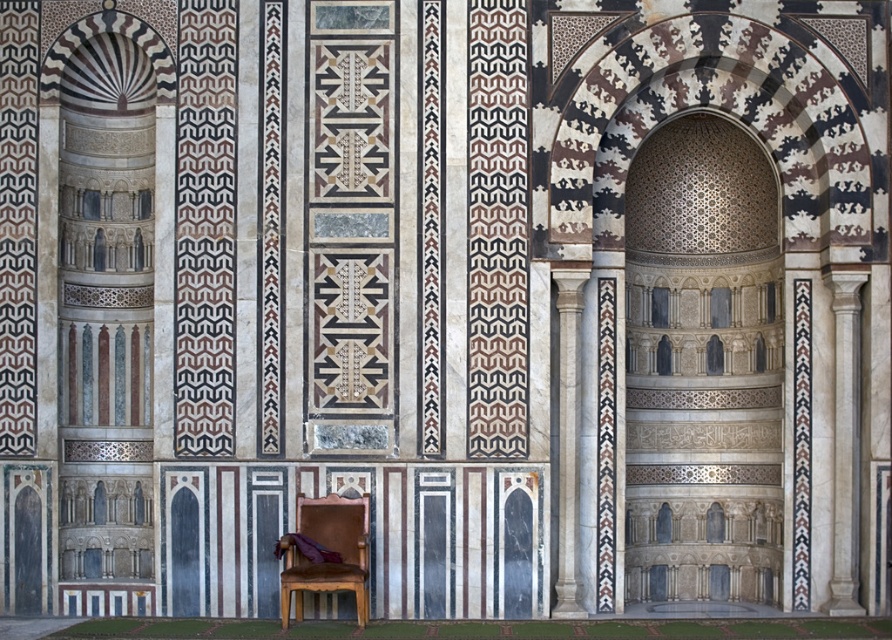
You are an interior designer planning to place a new sofa in this space. The sofa you have in mind is the same size as the white marble column at center. Would the brown leather armchair at lower center be a better fit for the space in terms of size compatibility?

The brown leather armchair at lower center is larger than the white marble column at center. Since the sofa is the same size as the column, the armchair would not be as compatible in terms of size and might overwhelm the space.

From the picture: You are an interior designer assessing the space for accessibility. You need to ensure that a person in a wheelchair can comfortably navigate between the brown leather armchair at lower center and the white marble column at center. Considering their heights, is there any obstruction due to height differences?

The brown leather armchair at lower center has a lesser height compared to the white marble column at center, so the wheelchair user should have no issue navigating between them as the height difference is minimal and not obstructive.

You are standing in the center of the room and notice two points marked in the scene. The first point is at coordinates point (334,515) and the second is at point (558,548). Which of these two points is closer to your current position?

Point (334,515) is closer to the viewer than point (558,548), so the first point is closer to your current position.